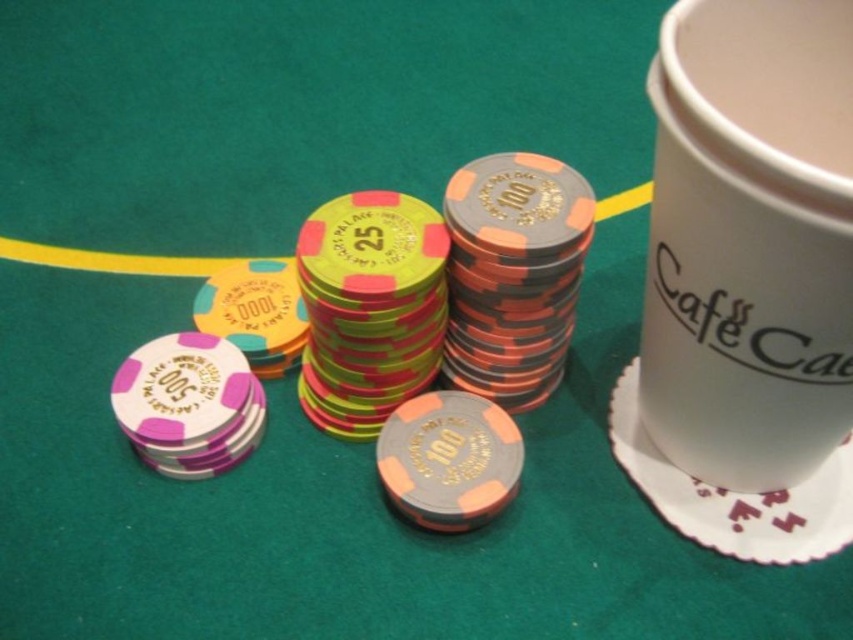
You are a bartender preparing drinks at a poker table. You have a white paper cup at right and a white paper saucer at upper right. Which item can hold more liquid based on their height?

The white paper cup at right is taller than the white paper saucer at upper right, so it can hold more liquid.

You are a bartender preparing drinks for a poker game. You have a drink that needs to be placed between the white paper cup at right and the white paper saucer at upper right. Can the drink fit in the space between them?

The distance between the white paper cup at right and the white paper saucer at upper right is 9.72 inches. Assuming the drink is narrower than this distance, it should fit comfortably between them.